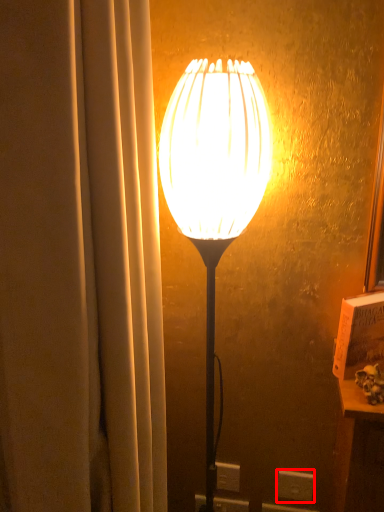
Question: From the image's perspective, where is electric outlet (annotated by the red box) located in relation to lamp in the image?

Choices:
 (A) above
 (B) below

Answer: (B)